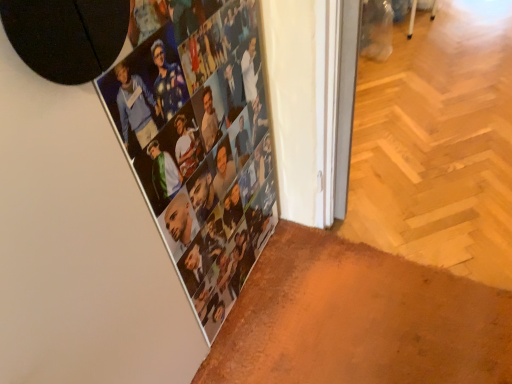
What do you see at coordinates (201, 144) in the screenshot? I see `metallic silver photo collage at upper left` at bounding box center [201, 144].

Find the location of a particular element. This screenshot has width=512, height=384. metallic silver photo collage at upper left is located at coordinates (201, 144).

At what (x,y) coordinates should I click in order to perform the action: click on metallic silver photo collage at upper left. Please return your answer as a coordinate pair (x, y). Image resolution: width=512 pixels, height=384 pixels. Looking at the image, I should click on (201, 144).